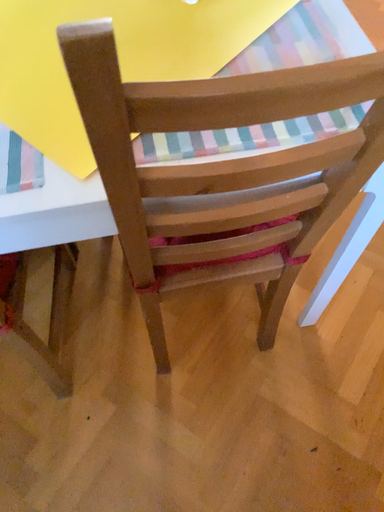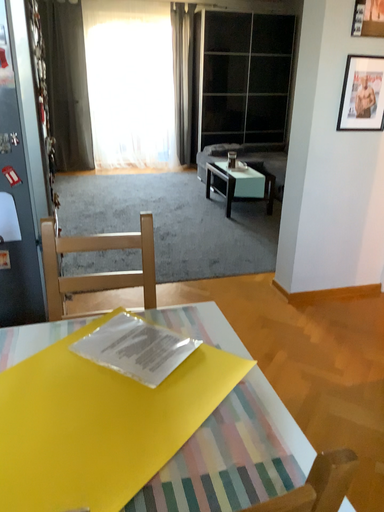
Question: Which way did the camera rotate in the video?

Choices:
 (A) rotated downward
 (B) rotated upward

Answer: (B)